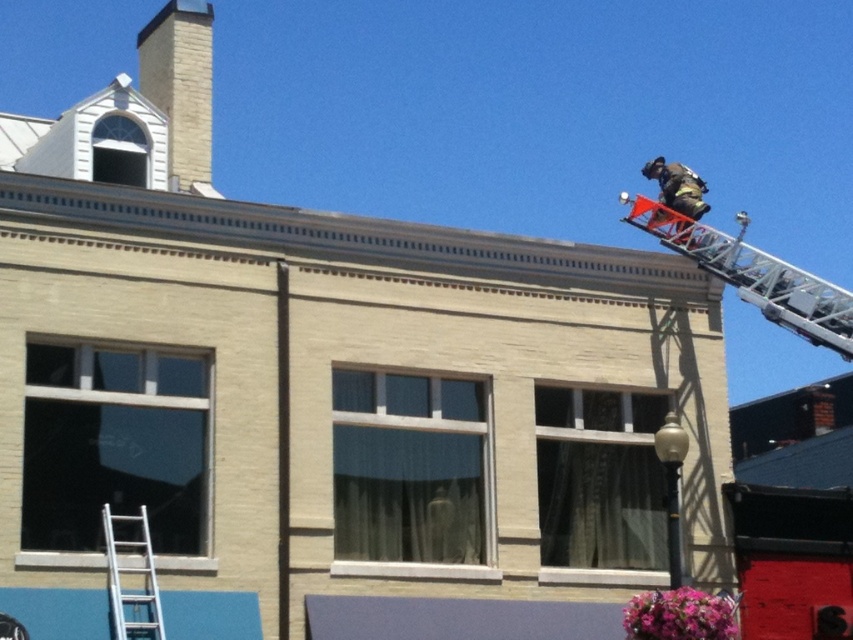
Question: Which of these objects is positioned farthest from the orange metallic ladder at upper right?

Choices:
 (A) silver metallic ladder at lower left
 (B) brick chimney at upper left
 (C) reflective silver helmet at upper right

Answer: (B)

Question: Which object is positioned closest to the silver metallic ladder at lower left?

Choices:
 (A) reflective silver helmet at upper right
 (B) brick chimney at upper left
 (C) orange metallic ladder at upper right

Answer: (B)

Question: Which point appears closest to the camera in this image?

Choices:
 (A) (195, 13)
 (B) (115, 582)

Answer: (B)

Question: Can you confirm if silver metallic ladder at lower left is positioned to the left of reflective silver helmet at upper right?

Choices:
 (A) yes
 (B) no

Answer: (A)

Question: Can you confirm if orange metallic ladder at upper right is thinner than reflective silver helmet at upper right?

Choices:
 (A) yes
 (B) no

Answer: (B)

Question: Does silver metallic ladder at lower left appear on the left side of reflective silver helmet at upper right?

Choices:
 (A) yes
 (B) no

Answer: (A)